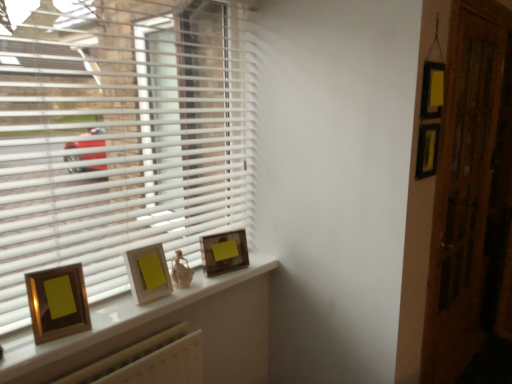
Image resolution: width=512 pixels, height=384 pixels. I want to click on vacant area that is in front of matte gold picture frame at center, marked as the 2th picture frame in a left-to-right arrangement, so click(135, 314).